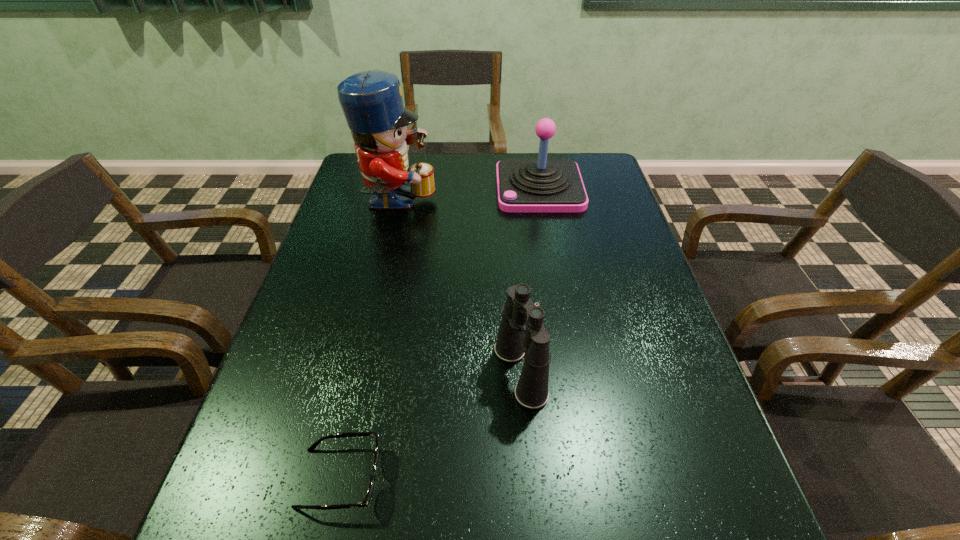
In the image, there is a desktop. At what (x,y) coordinates should I click in order to perform the action: click on blank space at the left edge. Please return your answer as a coordinate pair (x, y). The height and width of the screenshot is (540, 960). Looking at the image, I should click on (336, 208).

Locate an element on the screen. The height and width of the screenshot is (540, 960). free space at the right edge of the desktop is located at coordinates (598, 215).

Where is `free area in between the nutcracker and the spectacles`? The image size is (960, 540). free area in between the nutcracker and the spectacles is located at coordinates (369, 341).

Locate an element on the screen. blank region between the shortest object and the binoculars is located at coordinates (430, 425).

In order to click on vacant space that's between the shortest object and the third farthest object in this screenshot , I will do `click(430, 425)`.

Identify the location of free point between the joystick and the nearest object. (440, 333).

Identify the location of vacant area that lies between the shortest object and the binoculars. tap(430, 425).

Image resolution: width=960 pixels, height=540 pixels. I want to click on blank region between the binoculars and the joystick, so click(530, 280).

This screenshot has width=960, height=540. Find the location of `free space that is in between the binoculars and the nutcracker`. free space that is in between the binoculars and the nutcracker is located at coordinates (459, 288).

At what (x,y) coordinates should I click in order to perform the action: click on free space between the nearest object and the second nearest object. Please return your answer as a coordinate pair (x, y). This screenshot has width=960, height=540. Looking at the image, I should click on (430, 425).